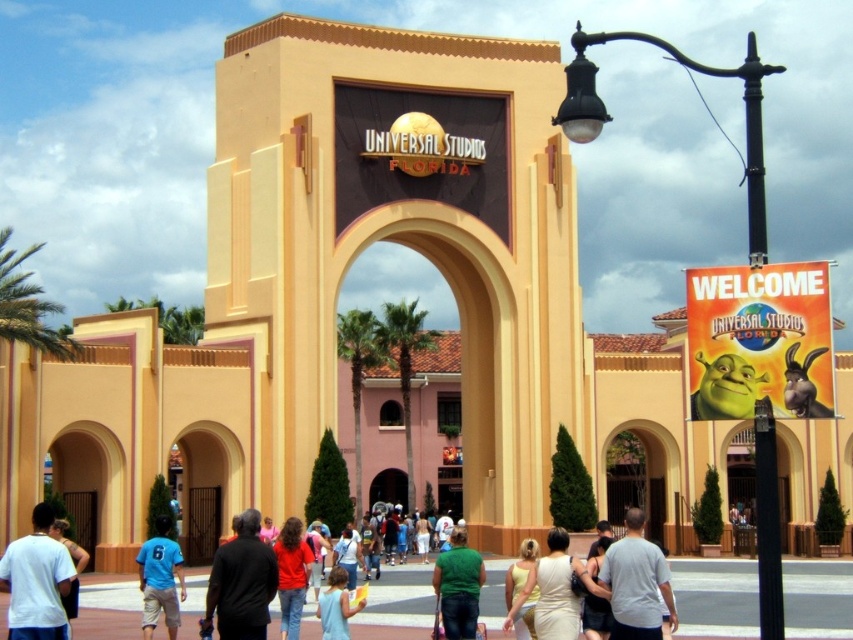
Does point (289, 560) lie in front of point (68, 544)?

No, it is not.

Is matte red shirt at center thinner than matte white shirt at lower left?

Correct, matte red shirt at center's width is less than matte white shirt at lower left's.

Which is behind, point (309, 570) or point (71, 598)?

Point (309, 570)

Find the location of a particular element. matte red shirt at center is located at coordinates (292, 573).

Does matte red shirt at center appear under light blue shirt at center?

No.

Locate an element on the screen. matte red shirt at center is located at coordinates tap(292, 573).

Can you confirm if matte red shirt at center is bigger than matte yellow dress at center?

No, matte red shirt at center is not bigger than matte yellow dress at center.

Based on the photo, which is more to the left, matte red shirt at center or matte yellow dress at center?

matte red shirt at center is more to the left.

Image resolution: width=853 pixels, height=640 pixels. What do you see at coordinates (292, 573) in the screenshot?
I see `matte red shirt at center` at bounding box center [292, 573].

This screenshot has width=853, height=640. I want to click on matte red shirt at center, so (x=292, y=573).